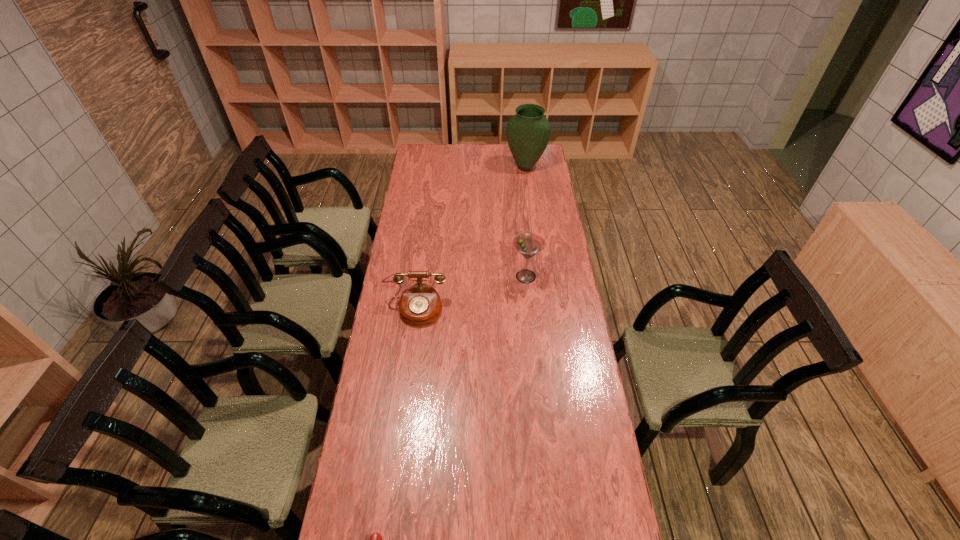
Identify the location of object at the left edge. (420, 304).

The image size is (960, 540). I want to click on vase that is at the right edge, so click(528, 132).

Where is `martini that is at the right edge`? martini that is at the right edge is located at coordinates click(x=528, y=244).

The image size is (960, 540). Find the location of `object present at the far right corner`. object present at the far right corner is located at coordinates (528, 132).

The image size is (960, 540). Identify the location of blank area at the left edge. (379, 346).

Where is `free space at the right edge`? free space at the right edge is located at coordinates (547, 329).

Find the location of a particular element. free space that is in between the tallest object and the second tallest object is located at coordinates (526, 221).

At what (x,y) coordinates should I click in order to perform the action: click on empty space that is in between the farthest object and the farther telephone. Please return your answer as a coordinate pair (x, y). The width and height of the screenshot is (960, 540). Looking at the image, I should click on (470, 238).

Locate an element on the screen. The width and height of the screenshot is (960, 540). unoccupied area between the second farthest object and the taller telephone is located at coordinates (470, 293).

Where is `vacant space in between the taller telephone and the martini`? The image size is (960, 540). vacant space in between the taller telephone and the martini is located at coordinates (470, 293).